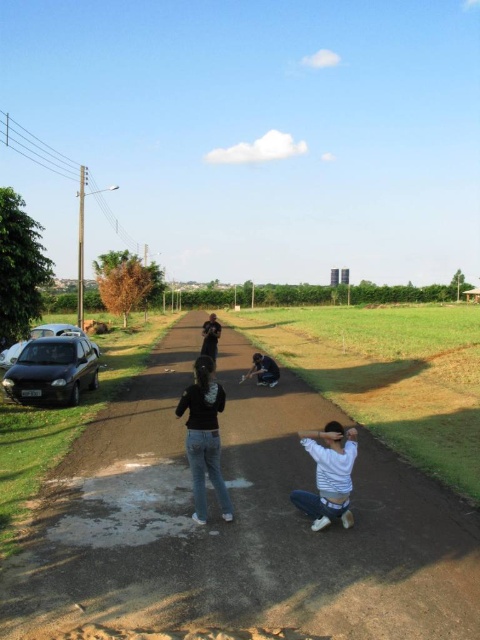
You are a delivery person trying to deliver a package to the brown asphalt road at center. However, there is a dark gray fabric squat at center in the way. Can you place the package on the road without moving the fabric?

The brown asphalt road at center is positioned under the dark gray fabric squat at center, so the fabric is blocking access to the road. You cannot place the package on the road without moving the fabric.

You are standing at the entrance of the path and want to reach the dark gray fabric squat at center. Which direction should you walk to get there?

The dark gray fabric squat at center is located at point (263, 371), so you should walk towards the center of the path to reach it.